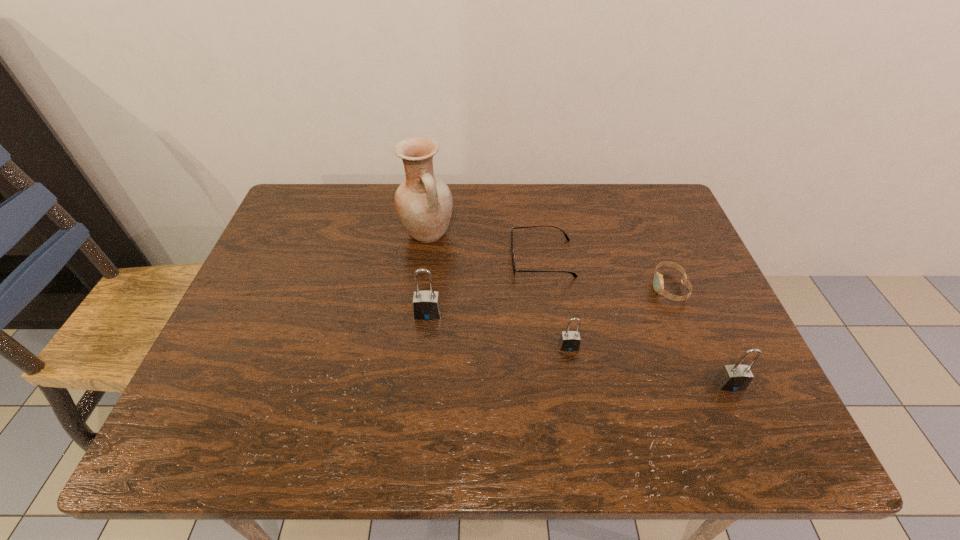
You are a GUI agent. You are given a task and a screenshot of the screen. Output one action in this format:
    pyautogui.click(x=<x>, y=<y>)
    Task: Click on the padlock at the right edge
    This screenshot has height=540, width=960.
    Given the screenshot: What is the action you would take?
    pyautogui.click(x=737, y=377)

Locate an element on the screen. This screenshot has width=960, height=540. watch that is positioned at the right edge is located at coordinates (658, 283).

Locate an element on the screen. object positioned at the near right corner is located at coordinates (737, 377).

In the image, there is a desktop. Where is `vacant space at the far edge`? This screenshot has height=540, width=960. vacant space at the far edge is located at coordinates (501, 193).

This screenshot has height=540, width=960. Find the location of `vacant point at the near edge`. vacant point at the near edge is located at coordinates (476, 387).

Locate an element on the screen. Image resolution: width=960 pixels, height=540 pixels. vacant space at the left edge of the desktop is located at coordinates (301, 250).

Where is `blank space at the right edge of the desktop`? The image size is (960, 540). blank space at the right edge of the desktop is located at coordinates (684, 323).

Identify the location of free space at the far left corner of the desktop. (291, 212).

The width and height of the screenshot is (960, 540). What are the coordinates of `free space at the far right corner of the desktop` in the screenshot? It's located at (619, 187).

Locate an element on the screen. The image size is (960, 540). unoccupied area between the watch and the rightmost padlock is located at coordinates (700, 336).